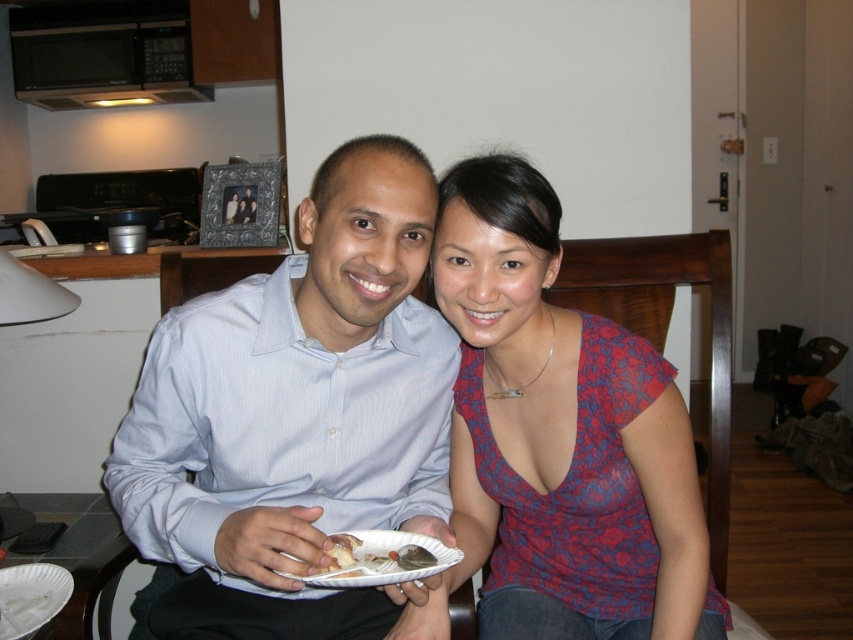
You are arranging a small dinner party and need to place a decorative bread centerpiece on the counter between the black matte microwave at upper left and the white matte bread at center. Where should you position it to ensure it is centered between them?

The black matte microwave at upper left is to the left of the white matte bread at center, so placing the decorative bread centerpiece exactly halfway between them would center it between the two objects.